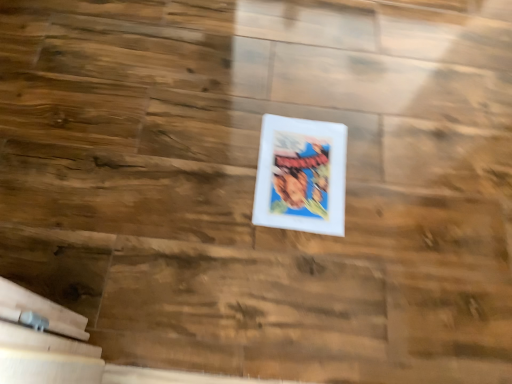
Identify the location of free spot in front of white matte picture frame at center. tap(283, 278).